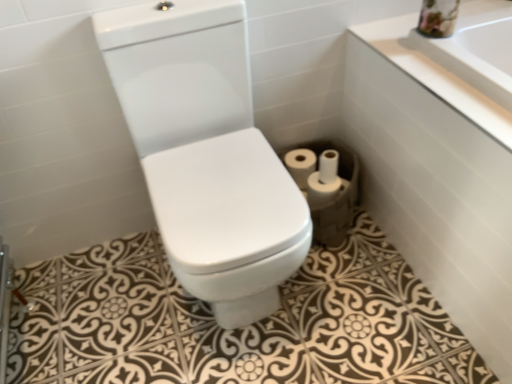
Question: Could you tell me if white matte toilet paper at center, which is counted as the 1th toilet paper, starting from the right, is turned towards white matte toilet paper at lower right, the third toilet paper in the right-to-left sequence?

Choices:
 (A) yes
 (B) no

Answer: (A)

Question: From the image's perspective, does white matte toilet paper at center, which is counted as the 1th toilet paper, starting from the right, appear lower than white matte toilet paper at lower right, arranged as the 2th toilet paper when viewed from the left?

Choices:
 (A) yes
 (B) no

Answer: (B)

Question: Are white matte toilet paper at center, which is counted as the 1th toilet paper, starting from the right, and white matte toilet paper at lower right, the third toilet paper in the right-to-left sequence, far apart?

Choices:
 (A) no
 (B) yes

Answer: (A)

Question: Is white matte toilet paper at center, marked as the fourth toilet paper in a left-to-right arrangement, placed right next to white matte toilet paper at lower right, arranged as the 2th toilet paper when viewed from the left?

Choices:
 (A) yes
 (B) no

Answer: (A)

Question: From a real-world perspective, is white matte toilet paper at center, marked as the fourth toilet paper in a left-to-right arrangement, located higher than white matte toilet paper at lower right, arranged as the 2th toilet paper when viewed from the left?

Choices:
 (A) yes
 (B) no

Answer: (B)

Question: Does point [310, 188] appear closer or farther from the camera than point [325, 180]?

Choices:
 (A) farther
 (B) closer

Answer: (A)

Question: From a real-world perspective, is white matte toilet paper at center, which is counted as the 1th toilet paper, starting from the right, above or below white matte toilet paper at lower right, marked as the 2th toilet paper in a right-to-left arrangement?

Choices:
 (A) below
 (B) above

Answer: (A)

Question: Considering the positions of white matte toilet paper at center, which is counted as the 1th toilet paper, starting from the right, and white matte toilet paper at lower right, marked as the 2th toilet paper in a right-to-left arrangement, in the image, is white matte toilet paper at center, which is counted as the 1th toilet paper, starting from the right, wider or thinner than white matte toilet paper at lower right, marked as the 2th toilet paper in a right-to-left arrangement,?

Choices:
 (A) thin
 (B) wide

Answer: (B)

Question: Considering the positions of white matte toilet paper at center, which is counted as the 1th toilet paper, starting from the right, and white matte toilet paper at lower right, marked as the 2th toilet paper in a right-to-left arrangement, in the image, is white matte toilet paper at center, which is counted as the 1th toilet paper, starting from the right, bigger or smaller than white matte toilet paper at lower right, marked as the 2th toilet paper in a right-to-left arrangement,?

Choices:
 (A) small
 (B) big

Answer: (B)

Question: Considering the positions of white matte toilet paper at lower right, arranged as the 2th toilet paper when viewed from the left, and white glossy bathtub at lower right in the image, is white matte toilet paper at lower right, arranged as the 2th toilet paper when viewed from the left, wider or thinner than white glossy bathtub at lower right?

Choices:
 (A) thin
 (B) wide

Answer: (A)

Question: Does point (316, 173) appear closer or farther from the camera than point (437, 145)?

Choices:
 (A) closer
 (B) farther

Answer: (B)

Question: Is white matte toilet paper at lower right, arranged as the 2th toilet paper when viewed from the left, inside the boundaries of white glossy bathtub at lower right, or outside?

Choices:
 (A) inside
 (B) outside

Answer: (B)

Question: Considering their positions, is white matte toilet paper at lower right, arranged as the 2th toilet paper when viewed from the left, located in front of or behind white glossy bathtub at lower right?

Choices:
 (A) behind
 (B) front

Answer: (A)

Question: Visually, is white matte toilet paper at center, the 1th toilet paper when ordered from left to right, positioned to the left or to the right of white matte toilet paper at center, which is counted as the 1th toilet paper, starting from the right?

Choices:
 (A) left
 (B) right

Answer: (A)

Question: From the image's perspective, relative to white matte toilet paper at center, which is counted as the 1th toilet paper, starting from the right, is white matte toilet paper at center, the 4th toilet paper in the right-to-left sequence, above or below?

Choices:
 (A) below
 (B) above

Answer: (B)